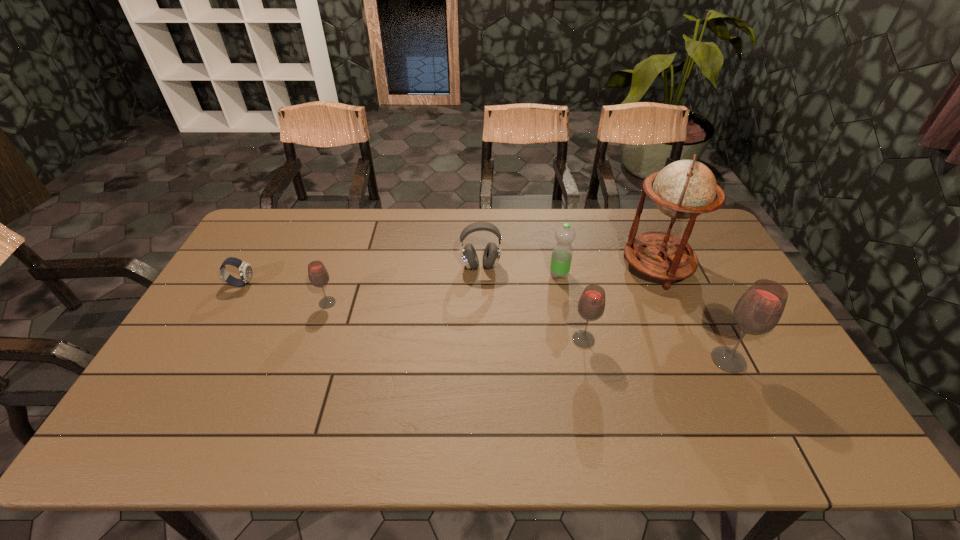
What are the coordinates of `vacant space positioned on the left of the second object from left to right` in the screenshot? It's located at (262, 303).

Locate an element on the screen. The height and width of the screenshot is (540, 960). vacant space located on the back of the second glass drink container from left to right is located at coordinates (569, 273).

The width and height of the screenshot is (960, 540). Identify the location of vacant region located on the left of the second tallest object. (650, 360).

Locate an element on the screen. vacant area situated 0.170m on the ear cups of the headset is located at coordinates (481, 315).

Identify the location of vacant space situated 0.360m on the surface of the tallest object. (512, 267).

In order to click on vacant space located on the surface of the tallest object in this screenshot , I will do `click(530, 267)`.

At what (x,y) coordinates should I click in order to perform the action: click on vacant space located on the surface of the tallest object. Please return your answer as a coordinate pair (x, y). Looking at the image, I should click on (524, 267).

At what (x,y) coordinates should I click in order to perform the action: click on vacant point located 0.290m on the right of the water bottle. Please return your answer as a coordinate pair (x, y). The image size is (960, 540). Looking at the image, I should click on (659, 274).

At what (x,y) coordinates should I click in order to perform the action: click on vacant space positioned 0.050m on the face of the leftmost object. Please return your answer as a coordinate pair (x, y). This screenshot has width=960, height=540. Looking at the image, I should click on (271, 284).

The image size is (960, 540). Identify the location of object that is at the far edge. (684, 189).